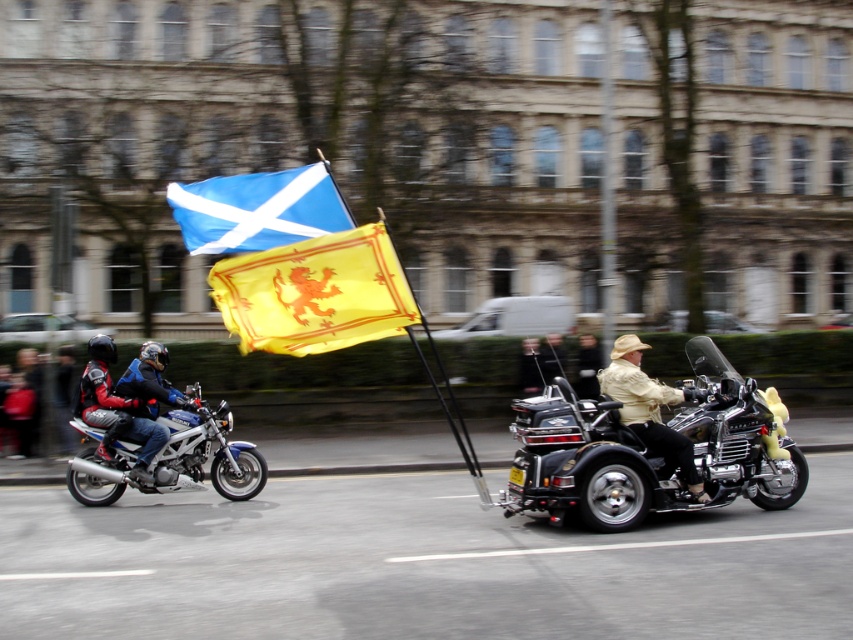
Question: Which point appears farthest from the camera in this image?

Choices:
 (A) (625, 416)
 (B) (51, 426)
 (C) (306, 180)
 (D) (171, 460)

Answer: (B)

Question: From the image, what is the correct spatial relationship of yellow fabric flag at center in relation to light brown leather jacket at center?

Choices:
 (A) left
 (B) right

Answer: (A)

Question: Considering the real-world distances, which object is farthest from the metallic blue motorcycle at left?

Choices:
 (A) black chrome trike at center
 (B) yellow fabric flag at center
 (C) blue fabric flag at center

Answer: (C)

Question: Is black chrome trike at center positioned at the back of metallic blue motorcycle at left?

Choices:
 (A) yes
 (B) no

Answer: (B)

Question: Does blue fabric flag at center appear on the right side of light beige leather jacket at center?

Choices:
 (A) no
 (B) yes

Answer: (A)

Question: Which object is positioned closest to the leather jacket at left?

Choices:
 (A) light beige leather jacket at center
 (B) black chrome trike at center
 (C) blue fabric flag at center

Answer: (A)